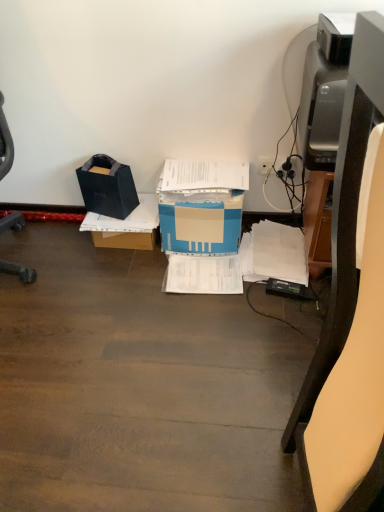
Question: Can you confirm if matte black printer at right is smaller than brown cardboard box at center?

Choices:
 (A) no
 (B) yes

Answer: (A)

Question: Is matte black printer at right taller than brown cardboard box at center?

Choices:
 (A) yes
 (B) no

Answer: (A)

Question: Is brown cardboard box at center a part of matte black printer at right?

Choices:
 (A) no
 (B) yes

Answer: (A)

Question: Does matte black printer at right appear on the right side of brown cardboard box at center?

Choices:
 (A) yes
 (B) no

Answer: (A)

Question: Is matte black printer at right bigger than brown cardboard box at center?

Choices:
 (A) no
 (B) yes

Answer: (B)

Question: Is matte black printer at right outside brown cardboard box at center?

Choices:
 (A) no
 (B) yes

Answer: (B)

Question: Does brown cardboard box at center have a lesser height compared to blue cardboard box at center, placed as the second box when sorted from left to right?

Choices:
 (A) no
 (B) yes

Answer: (B)

Question: Considering the relative sizes of brown cardboard box at center and blue cardboard box at center, the 1th box in the right-to-left sequence, in the image provided, is brown cardboard box at center taller than blue cardboard box at center, the 1th box in the right-to-left sequence,?

Choices:
 (A) yes
 (B) no

Answer: (B)

Question: From a real-world perspective, does brown cardboard box at center sit lower than blue cardboard box at center, the 1th box in the right-to-left sequence?

Choices:
 (A) no
 (B) yes

Answer: (B)

Question: Is brown cardboard box at center wider than blue cardboard box at center, placed as the second box when sorted from left to right?

Choices:
 (A) no
 (B) yes

Answer: (B)

Question: Does brown cardboard box at center lie behind blue cardboard box at center, the 1th box in the right-to-left sequence?

Choices:
 (A) yes
 (B) no

Answer: (A)

Question: Considering the relative sizes of brown cardboard box at center and blue cardboard box at center, placed as the second box when sorted from left to right, in the image provided, is brown cardboard box at center thinner than blue cardboard box at center, placed as the second box when sorted from left to right,?

Choices:
 (A) no
 (B) yes

Answer: (A)

Question: Considering the relative sizes of matte black printer at right and white plastic plug at upper right in the image provided, is matte black printer at right thinner than white plastic plug at upper right?

Choices:
 (A) no
 (B) yes

Answer: (A)